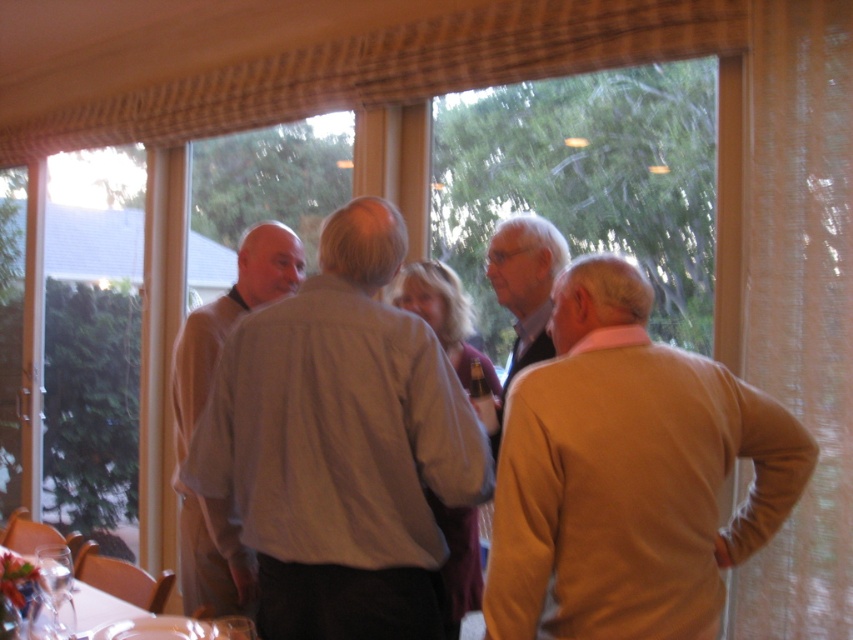
Can you confirm if light beige shirt at center is positioned to the left of clear glassware at lower left?

In fact, light beige shirt at center is to the right of clear glassware at lower left.

Which of these two, light beige shirt at center or clear glassware at lower left, stands taller?

light beige shirt at center is taller.

Locate an element on the screen. light beige shirt at center is located at coordinates (230, 317).

I want to click on light beige shirt at center, so click(x=230, y=317).

From the picture: Does transparent glass window at center appear over clear glassware at lower left?

Correct, transparent glass window at center is located above clear glassware at lower left.

Is transparent glass window at center further to the viewer compared to clear glassware at lower left?

Yes, transparent glass window at center is further from the viewer.

This screenshot has height=640, width=853. Identify the location of transparent glass window at center. (585, 182).

What do you see at coordinates (628, 474) in the screenshot? I see `light brown sweater at right` at bounding box center [628, 474].

Which of these two, light brown sweater at right or transparent glass window at center, stands taller?

Standing taller between the two is transparent glass window at center.

What do you see at coordinates (628, 474) in the screenshot? I see `light brown sweater at right` at bounding box center [628, 474].

You are a GUI agent. You are given a task and a screenshot of the screen. Output one action in this format:
    pyautogui.click(x=<x>, y=<y>)
    Task: Click on the light brown sweater at right
    
    Given the screenshot: What is the action you would take?
    pyautogui.click(x=628, y=474)